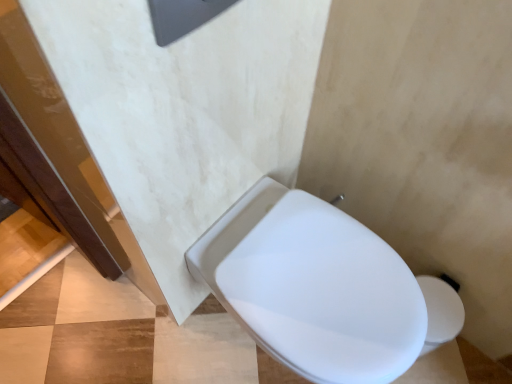
Question: Can you confirm if white glossy toilet at lower right is bigger than white glossy toilet at center?

Choices:
 (A) yes
 (B) no

Answer: (B)

Question: From a real-world perspective, is white glossy toilet at lower right below white glossy toilet at center?

Choices:
 (A) yes
 (B) no

Answer: (A)

Question: Is white glossy toilet at lower right outside of white glossy toilet at center?

Choices:
 (A) no
 (B) yes

Answer: (B)

Question: Does white glossy toilet at lower right have a greater height compared to white glossy toilet at center?

Choices:
 (A) yes
 (B) no

Answer: (B)

Question: Is white glossy toilet at lower right positioned far away from white glossy toilet at center?

Choices:
 (A) no
 (B) yes

Answer: (A)

Question: Considering the relative sizes of white glossy toilet at lower right and white glossy toilet at center in the image provided, is white glossy toilet at lower right shorter than white glossy toilet at center?

Choices:
 (A) yes
 (B) no

Answer: (A)

Question: Is white glossy toilet at center smaller than white glossy toilet at lower right?

Choices:
 (A) yes
 (B) no

Answer: (B)

Question: Would you say white glossy toilet at lower right is part of white glossy toilet at center's contents?

Choices:
 (A) yes
 (B) no

Answer: (B)

Question: Is white glossy toilet at center bigger than white glossy toilet at lower right?

Choices:
 (A) yes
 (B) no

Answer: (A)

Question: Does white glossy toilet at center have a lesser height compared to white glossy toilet at lower right?

Choices:
 (A) no
 (B) yes

Answer: (A)

Question: Does white glossy toilet at center have a greater height compared to white glossy toilet at lower right?

Choices:
 (A) yes
 (B) no

Answer: (A)

Question: From a real-world perspective, is white glossy toilet at center below white glossy toilet at lower right?

Choices:
 (A) yes
 (B) no

Answer: (B)

Question: Looking at their shapes, would you say white glossy toilet at lower right is wider or thinner than white glossy toilet at center?

Choices:
 (A) thin
 (B) wide

Answer: (B)